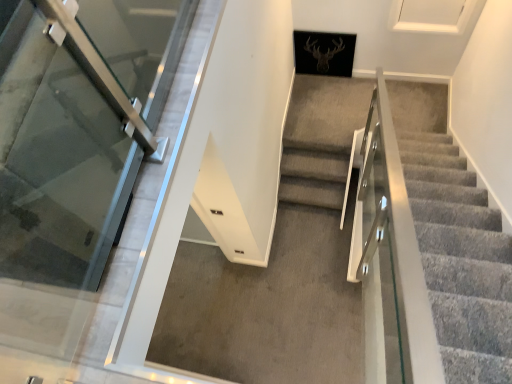
Question: Should I look upward or downward to see transparent glass door at left?

Choices:
 (A) up
 (B) down

Answer: (A)